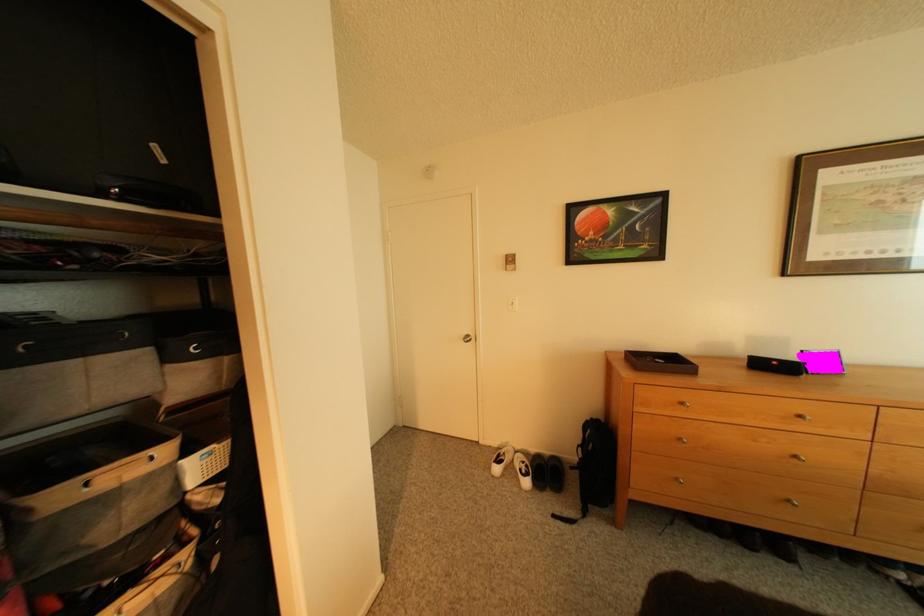
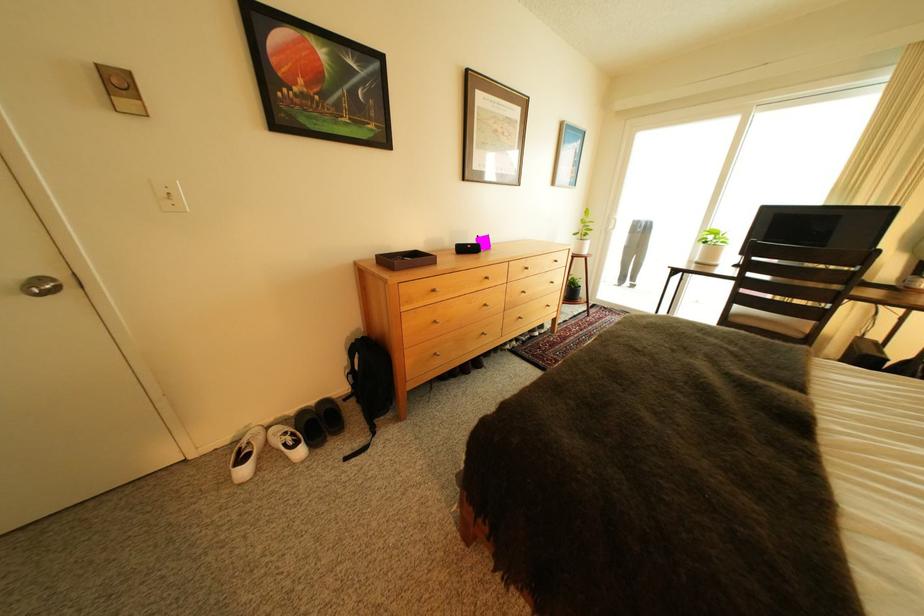
In the second image, find the point that corresponds to point 480,338 in the first image.

(55, 281)